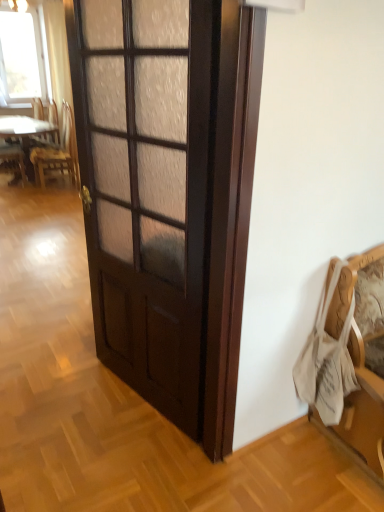
What do you see at coordinates (362, 357) in the screenshot? Image resolution: width=384 pixels, height=512 pixels. I see `wooden armchair at right` at bounding box center [362, 357].

What is the approximate height of wooden armchair at right?

It is 35.53 inches.

Where is `wooden armchair at right`? wooden armchair at right is located at coordinates [362, 357].

This screenshot has height=512, width=384. Identify the location of wooden armchair at right. (362, 357).